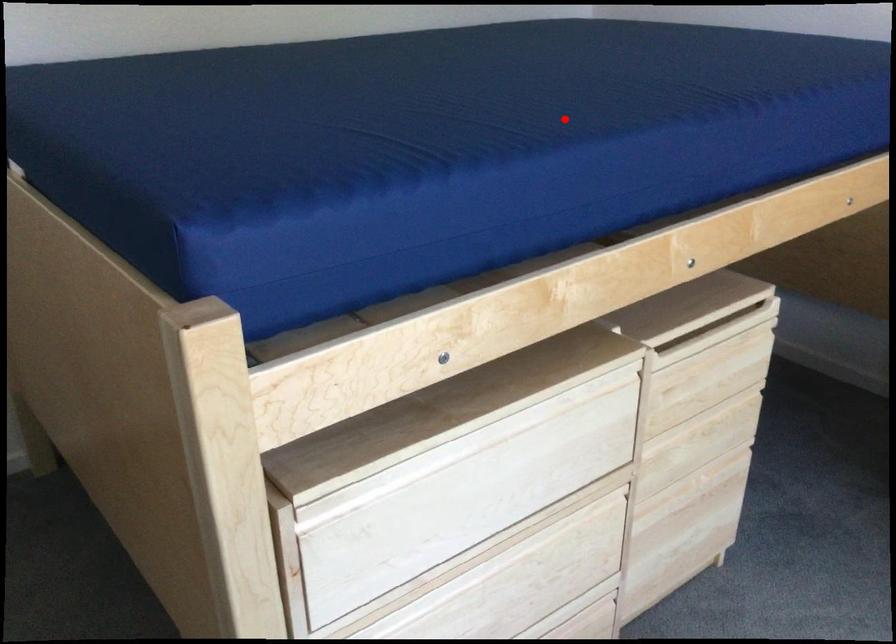
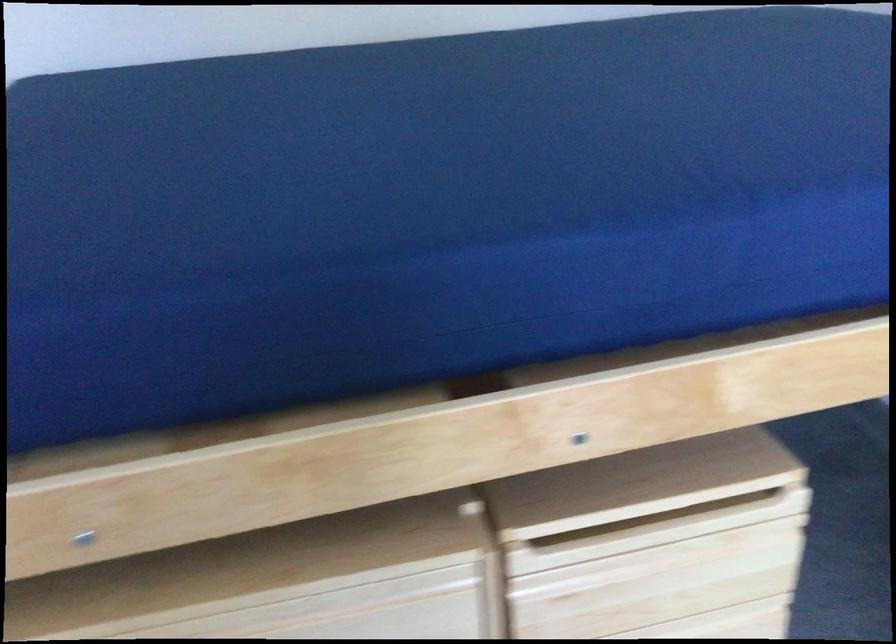
The point at the highlighted location is marked in the first image. Where is the corresponding point in the second image?

(431, 210)